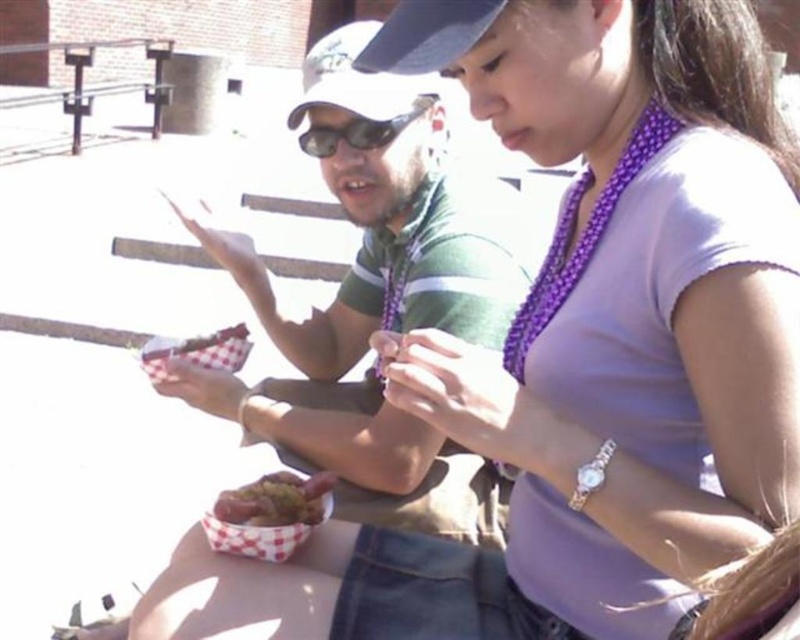
You are at a summer barbecue and see the shiny metallic hot dog at center and the sunglasses at center. Which object is smaller?

The shiny metallic hot dog at center is smaller than the sunglasses at center.

You are a photographer trying to capture a candid shot of the sunglasses at center without the shiny metallic hot dog at center blocking the view. Is this possible?

The shiny metallic hot dog at center is closer to the viewer than the sunglasses at center, so it would block the view of the sunglasses at center. Therefore, it is not possible to capture the sunglasses at center without the hot dog blocking it.